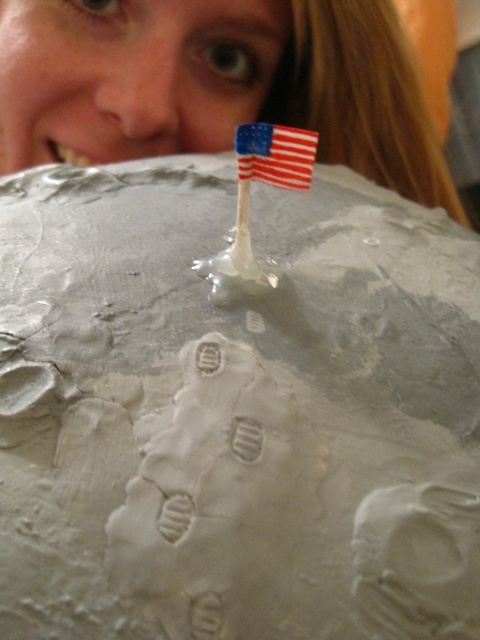
Question: Does matte skin at upper center have a lesser width compared to american flag at center?

Choices:
 (A) yes
 (B) no

Answer: (B)

Question: Can you confirm if matte skin at upper center is positioned to the right of american flag at center?

Choices:
 (A) yes
 (B) no

Answer: (B)

Question: Which point is farther to the camera?

Choices:
 (A) matte skin at upper center
 (B) american flag at center

Answer: (A)

Question: Is matte skin at upper center smaller than american flag at center?

Choices:
 (A) yes
 (B) no

Answer: (B)

Question: Which point appears farthest from the camera in this image?

Choices:
 (A) (292, 161)
 (B) (139, 42)

Answer: (B)